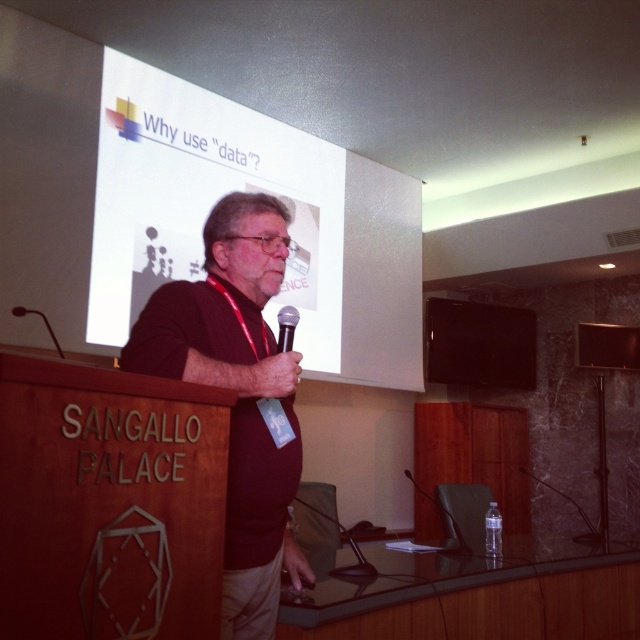
You are a photographer in the audience. You want to take a photo of the slide on the screen without any obstruction. The slide has two points marked at coordinates point (392,339) and point (241,314). Which point is closer to the camera so you can adjust your angle to avoid the man blocking the view?

Point (241,314) is closer to the camera than point (392,339). To avoid the man blocking the view, aim your camera towards the closer point (241,314) as it is less likely to be obscured by the presenter.

You are an attendee at the presentation. You want to take a photo of the slide on the white matte projection screen at upper center without the presenter blocking it. Is the dark red shirt at center in the way of the screen?

The white matte projection screen at upper center is much taller than the dark red shirt at center, so the presenter wearing the dark red shirt at center is only partially blocking the screen. You can adjust your angle or move slightly to capture the slide without obstruction from the dark red shirt at center.

You are an attendee at the presentation. You want to take a photo of the presenter to share on social media. However, you notice that part of the slide behind him is partially obscured by his dark red shirt at center. Where should you position yourself to capture the slide text without obstruction?

You should position yourself to the side of the presenter away from the dark red shirt at center, as the shirt is blocking part of the slide. Moving to the left or right of the presenter would allow you to capture the slide text clearly without obstruction from the shirt.